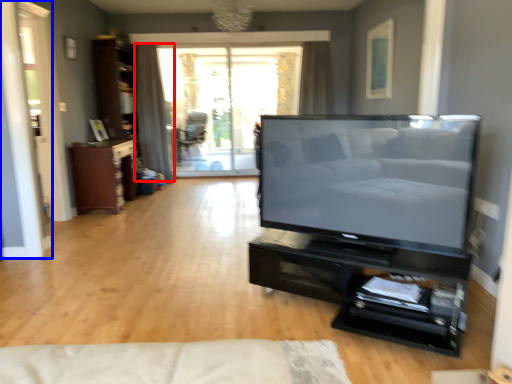
Question: Which point is further to the camera, curtain (highlighted by a red box) or screen door (highlighted by a blue box)?

Choices:
 (A) curtain
 (B) screen door

Answer: (A)